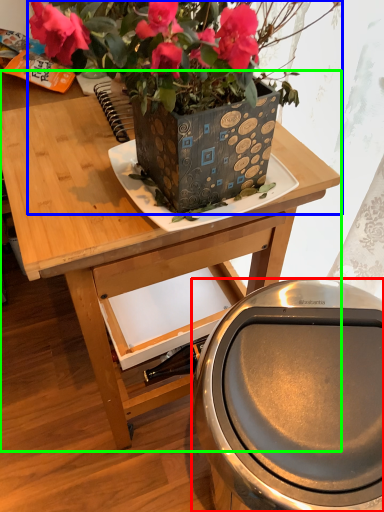
Question: Estimate the real-world distances between objects in this image. Which object is closer to potty (highlighted by a red box), houseplant (highlighted by a blue box) or table (highlighted by a green box)?

Choices:
 (A) houseplant
 (B) table

Answer: (B)